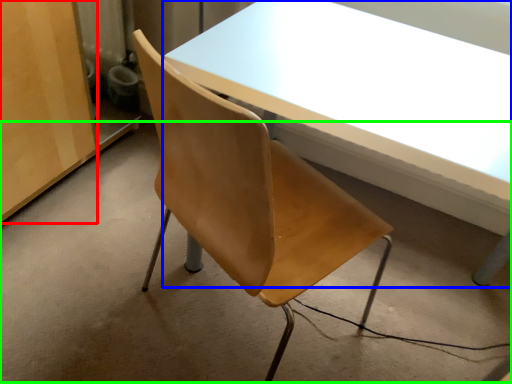
Question: Which object is the closest to the plywood (highlighted by a red box)? Choose among these: table (highlighted by a blue box) or concrete (highlighted by a green box).

Choices:
 (A) table
 (B) concrete

Answer: (B)